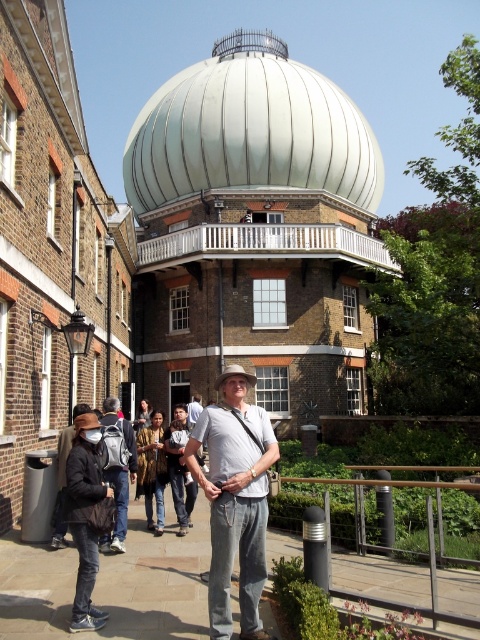
You are standing at the point marked by the coordinates point (118,474), which is where the matte gray backpack at center left is located. You want to walk towards the large white dome shaped roof of the building. Which direction should you head?

You should head towards the right since the large white dome shaped roof is to the right of the matte gray backpack at center left.

You are standing at the origin point of the image coordinate system. You want to take a photo of the patterned fabric jacket at center. In which direction should you move to get closer to the jacket?

Since the patterned fabric jacket at center is located at coordinate point 0.734 on the x axis and 0.317 on the y axis, you should move towards the right and slightly upwards to reach it.